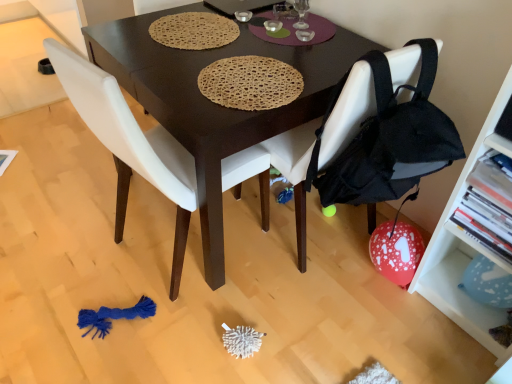
You are a GUI agent. You are given a task and a screenshot of the screen. Output one action in this format:
    pyautogui.click(x=<x>, y=<y>)
    Task: Click on the free location to the left of white matte chair at center, which ranks as the second chair in right-to-left order
    This screenshot has width=512, height=384.
    Given the screenshot: What is the action you would take?
    pyautogui.click(x=72, y=240)